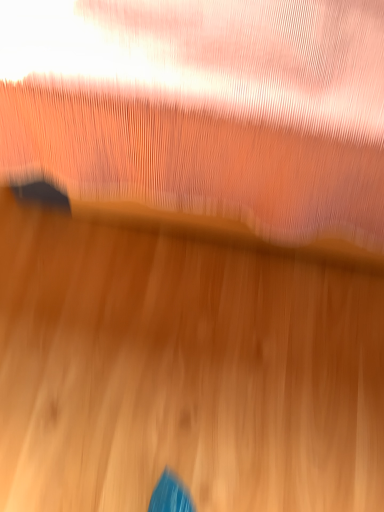
Question: From the image's perspective, is pink sheer curtain at upper center above or below wooden floor at center?

Choices:
 (A) above
 (B) below

Answer: (A)

Question: Is pink sheer curtain at upper center wider or thinner than wooden floor at center?

Choices:
 (A) thin
 (B) wide

Answer: (B)

Question: Do you think pink sheer curtain at upper center is within wooden floor at center, or outside of it?

Choices:
 (A) outside
 (B) inside

Answer: (A)

Question: Relative to pink sheer curtain at upper center, is wooden floor at center in front or behind?

Choices:
 (A) behind
 (B) front

Answer: (A)

Question: From a real-world perspective, is wooden floor at center positioned above or below pink sheer curtain at upper center?

Choices:
 (A) above
 (B) below

Answer: (B)

Question: In terms of height, does wooden floor at center look taller or shorter compared to pink sheer curtain at upper center?

Choices:
 (A) tall
 (B) short

Answer: (B)

Question: Does point (253, 295) appear closer or farther from the camera than point (168, 172)?

Choices:
 (A) closer
 (B) farther

Answer: (B)